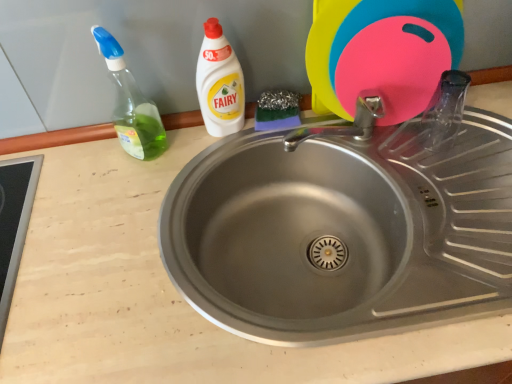
Where is `vacant space positioned to the left of green translucent bottle at left`? vacant space positioned to the left of green translucent bottle at left is located at coordinates (69, 170).